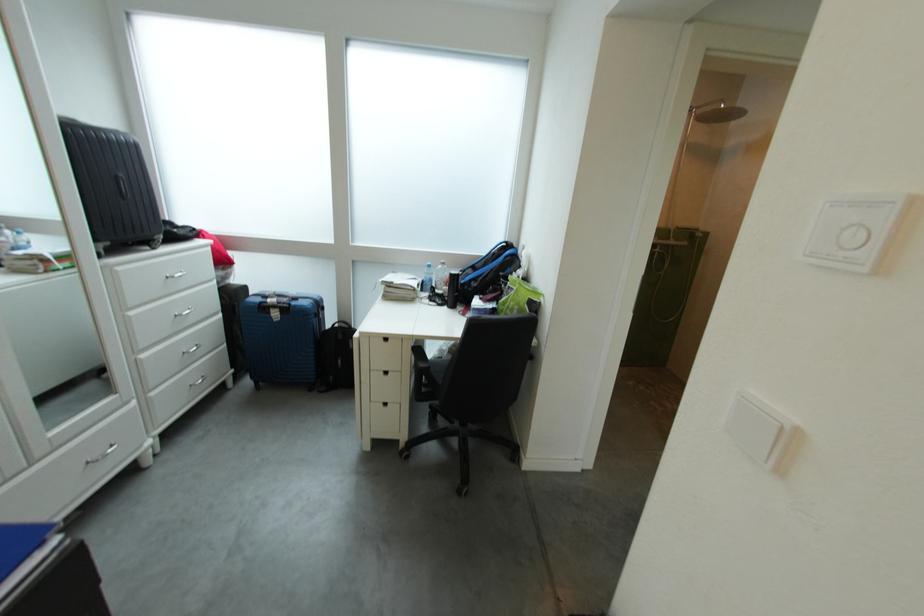
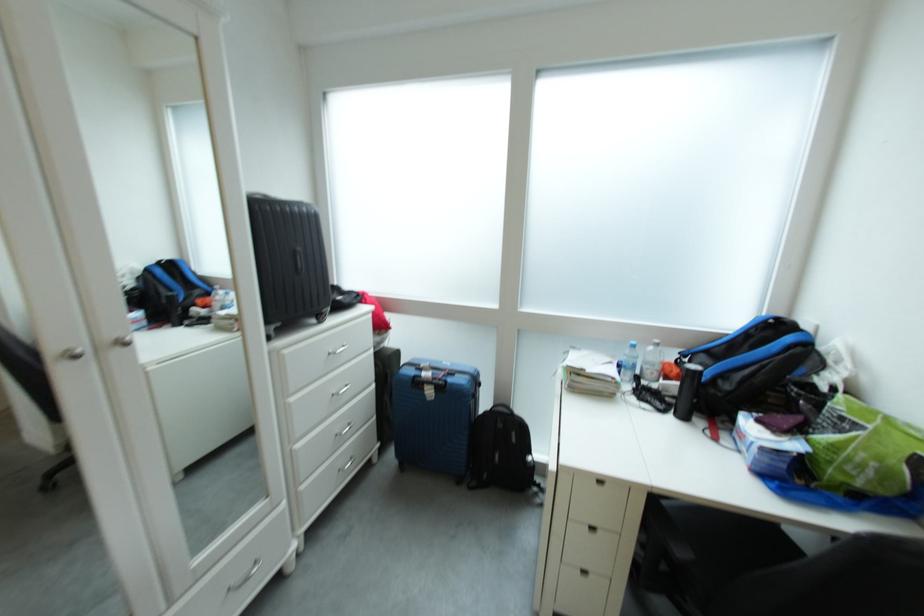
Locate, in the second image, the point that corresponds to point (485, 286) in the first image.

(737, 390)